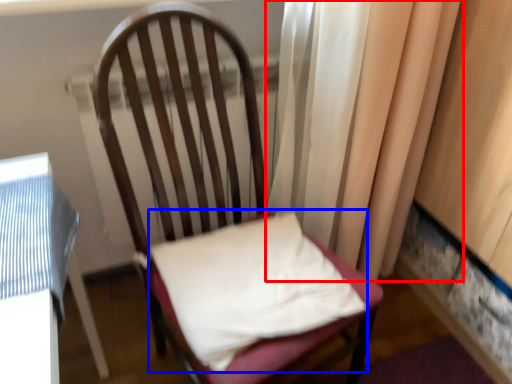
Question: Which of the following is the closest to the observer, curtain (highlighted by a red box) or pillow (highlighted by a blue box)?

Choices:
 (A) curtain
 (B) pillow

Answer: (B)